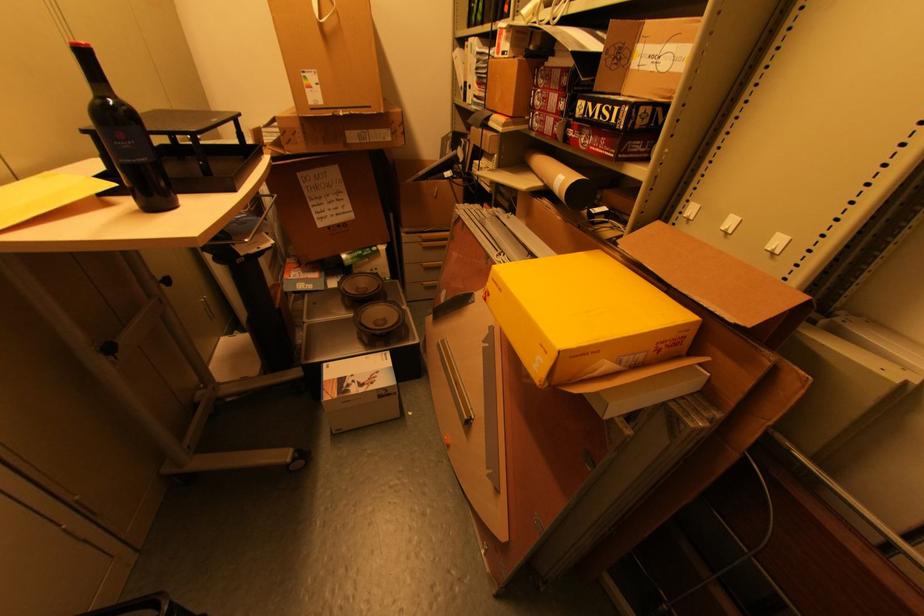
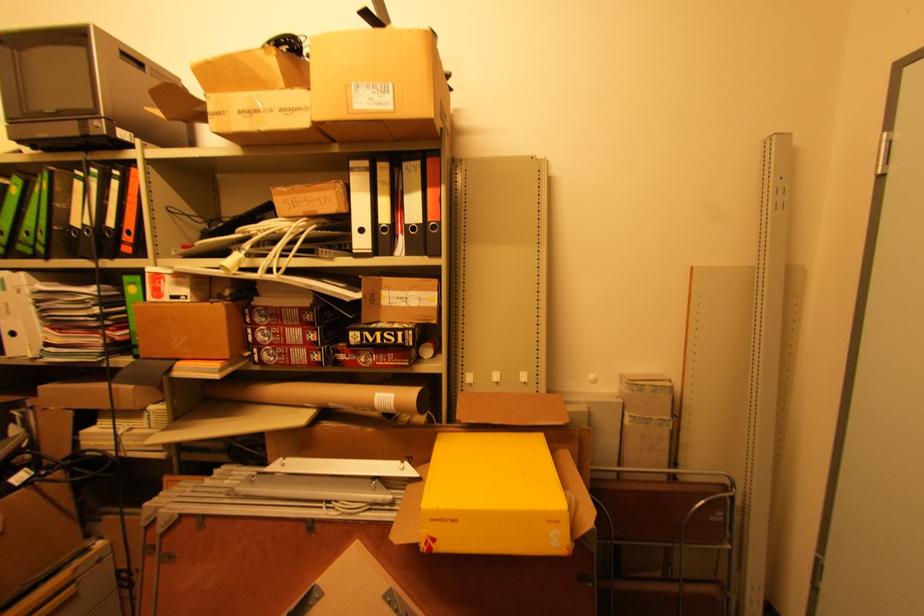
Question: Based on the continuous images, in which direction is the camera rotating? Reply with the corresponding letter.

Choices:
 (A) Left
 (B) Right
 (C) Up
 (D) Down

Answer: (B)